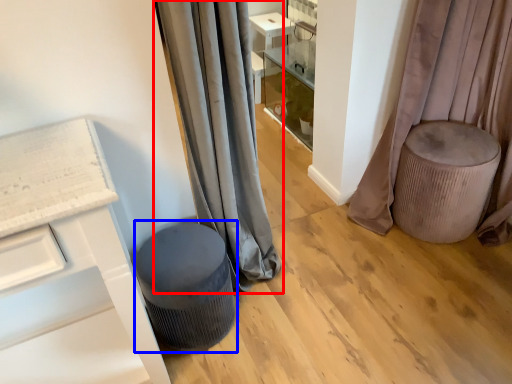
Question: Which point is closer to the camera, curtain (highlighted by a red box) or music stool (highlighted by a blue box)?

Choices:
 (A) curtain
 (B) music stool

Answer: (A)